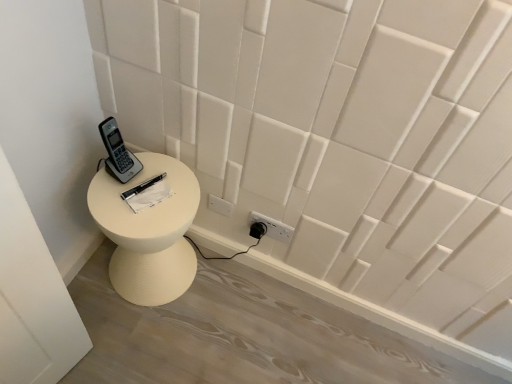
At what (x,y) coordinates should I click in order to perform the action: click on free space in front of white paper at center. Please return your answer as a coordinate pair (x, y). This screenshot has width=512, height=384. Looking at the image, I should click on (139, 216).